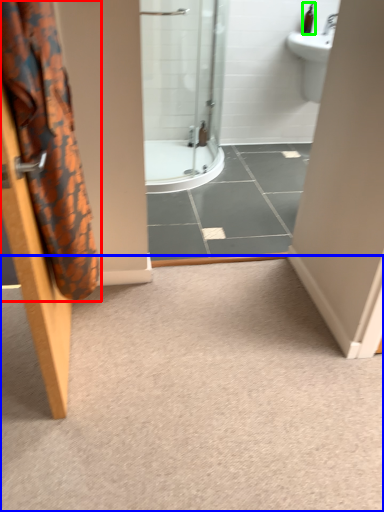
Question: Based on their relative distances, which object is farther from shower curtain (highlighted by a red box)? Choose from plain (highlighted by a blue box) and toiletry (highlighted by a green box).

Choices:
 (A) plain
 (B) toiletry

Answer: (B)